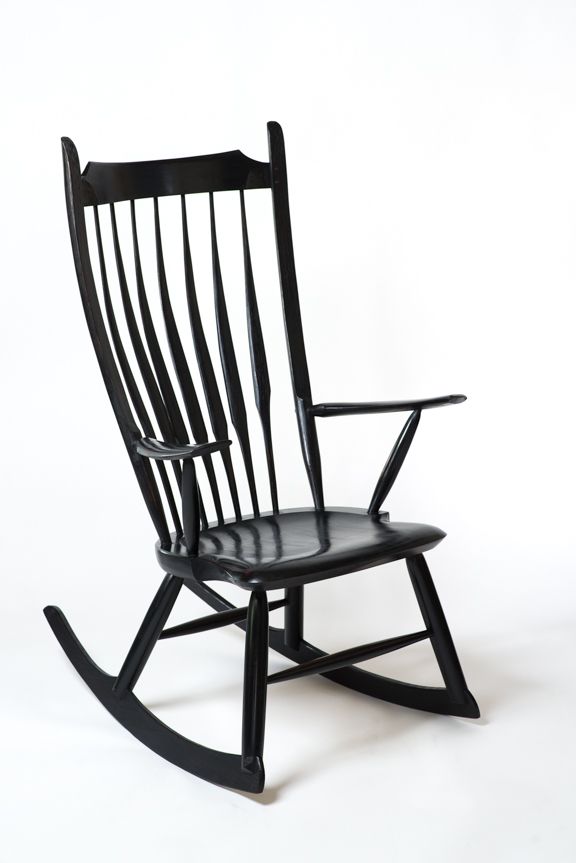
In order to click on seat of chair in this screenshot , I will do [x=295, y=543].